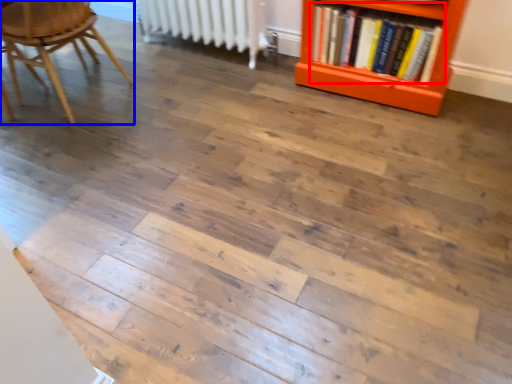
Question: Which of the following is the farthest to the observer, book (highlighted by a red box) or chair (highlighted by a blue box)?

Choices:
 (A) book
 (B) chair

Answer: (A)